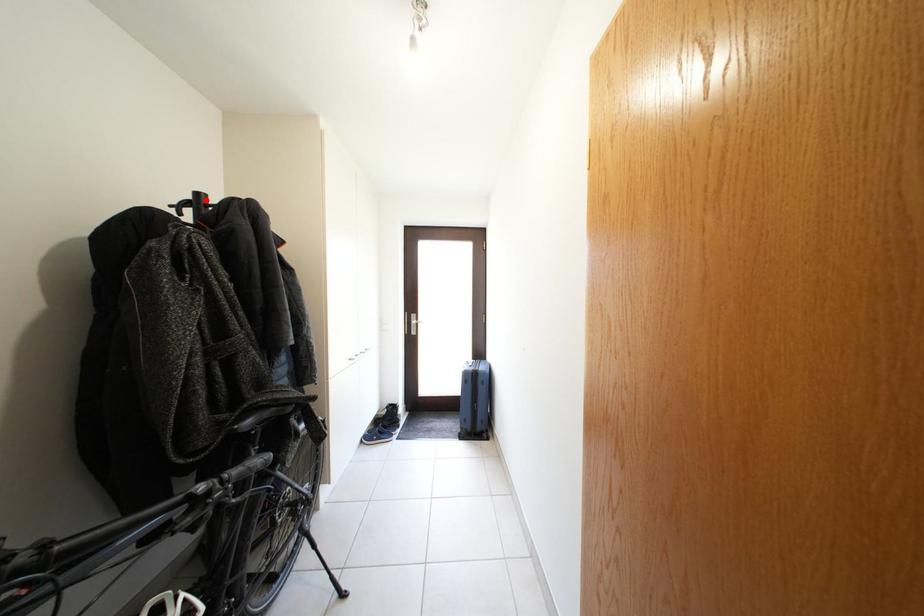
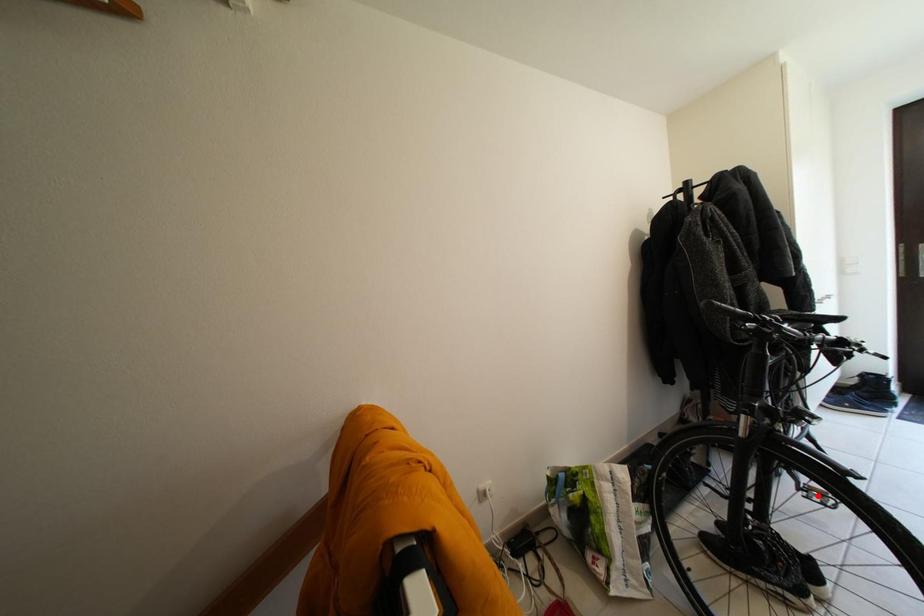
I am providing you with two images of the same scene from different viewpoints. A red point is marked on the first image and another point is marked on the second image. Is the red point in image1 aligned with the point shown in image2?

No